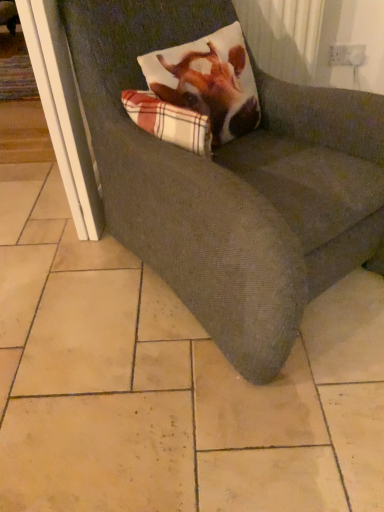
Question: From a real-world perspective, is white plastic screen door at left below plaid fabric pillow at upper center?

Choices:
 (A) no
 (B) yes

Answer: (B)

Question: Would you say white plastic screen door at left is a long distance from plaid fabric pillow at upper center?

Choices:
 (A) no
 (B) yes

Answer: (A)

Question: Is white plastic screen door at left bigger than plaid fabric pillow at upper center?

Choices:
 (A) yes
 (B) no

Answer: (A)

Question: Does white plastic screen door at left have a greater width compared to plaid fabric pillow at upper center?

Choices:
 (A) no
 (B) yes

Answer: (B)

Question: Considering the relative positions of white plastic screen door at left and plaid fabric pillow at upper center in the image provided, is white plastic screen door at left in front of plaid fabric pillow at upper center?

Choices:
 (A) no
 (B) yes

Answer: (A)

Question: Is white plastic screen door at left further to the viewer compared to plaid fabric pillow at upper center?

Choices:
 (A) no
 (B) yes

Answer: (B)

Question: Does textured gray couch at center have a greater height compared to white plastic screen door at left?

Choices:
 (A) no
 (B) yes

Answer: (B)

Question: From the image's perspective, does textured gray couch at center appear higher than white plastic screen door at left?

Choices:
 (A) yes
 (B) no

Answer: (B)

Question: Are textured gray couch at center and white plastic screen door at left located far from each other?

Choices:
 (A) yes
 (B) no

Answer: (B)

Question: Is textured gray couch at center with white plastic screen door at left?

Choices:
 (A) yes
 (B) no

Answer: (B)

Question: Can white plastic screen door at left be found inside textured gray couch at center?

Choices:
 (A) yes
 (B) no

Answer: (B)

Question: Does textured gray couch at center have a larger size compared to white plastic screen door at left?

Choices:
 (A) no
 (B) yes

Answer: (B)

Question: From the image's perspective, does plaid fabric pillow at upper center appear lower than textured gray couch at center?

Choices:
 (A) no
 (B) yes

Answer: (A)